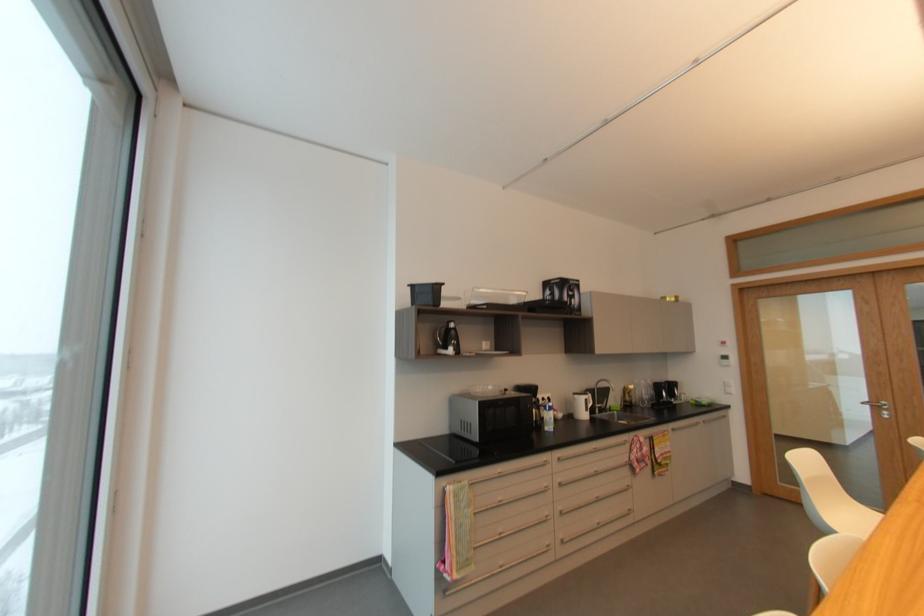
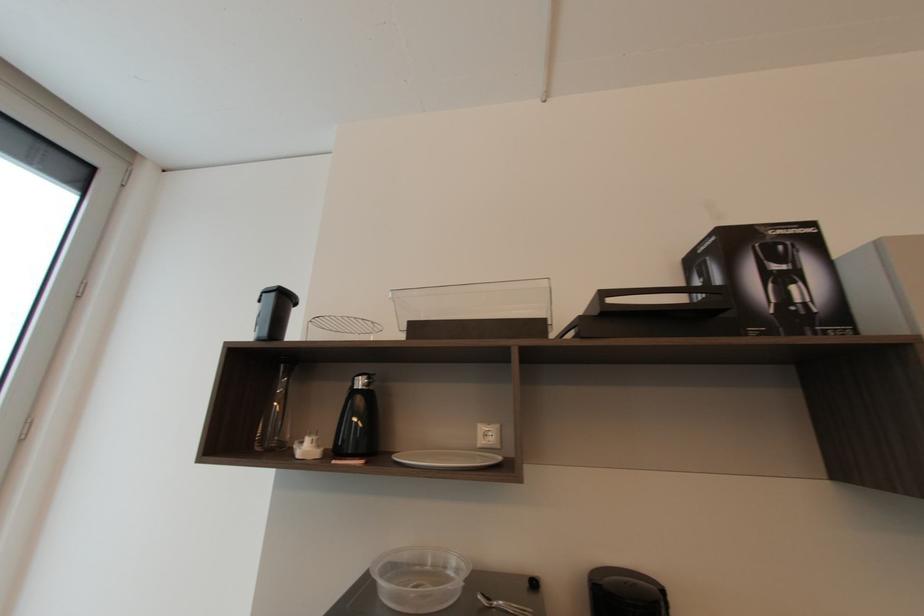
In the second image, find the point that corresponds to point 456,323 in the first image.

(362, 384)